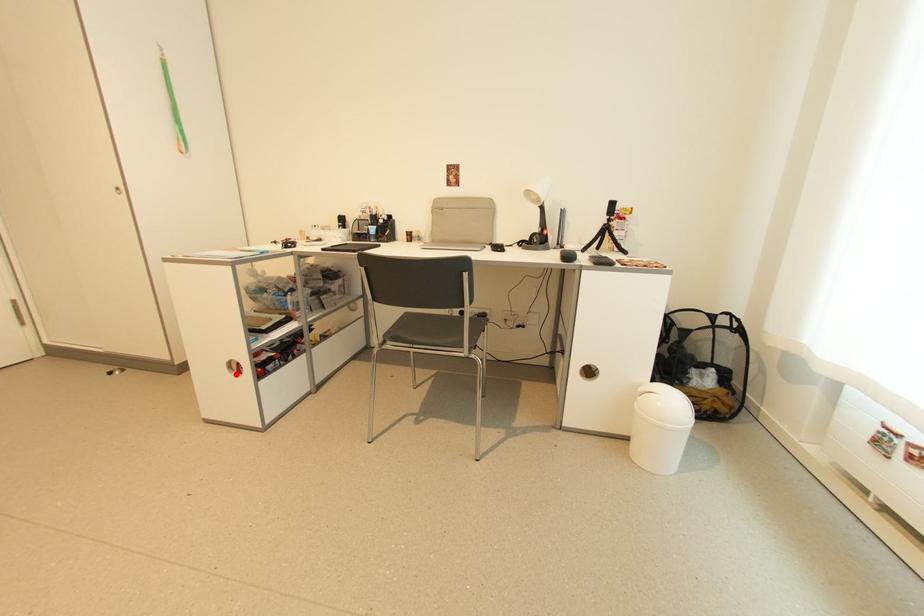
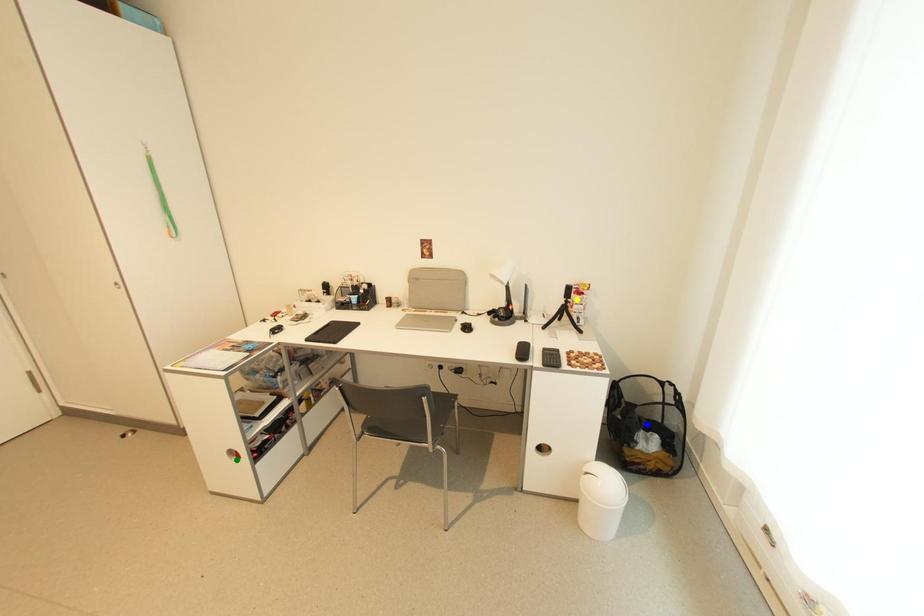
Question: I am providing you with two images of the same scene from different viewpoints. A red point is marked on the first image. You are given multiple points on the second image. In image 2, which mark is for the same physical point as the one in image 1?

Choices:
 (A) blue point
 (B) green point
 (C) yellow point

Answer: (B)